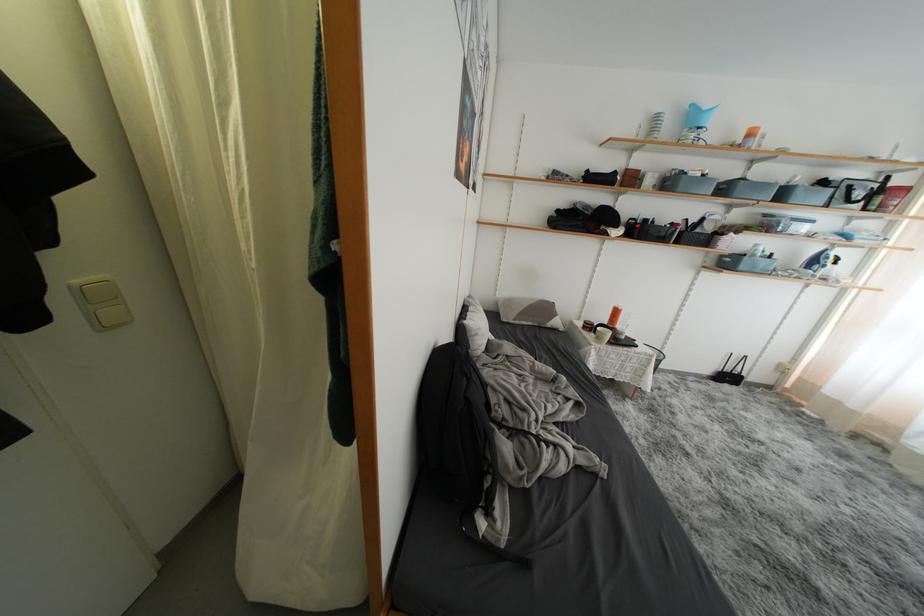
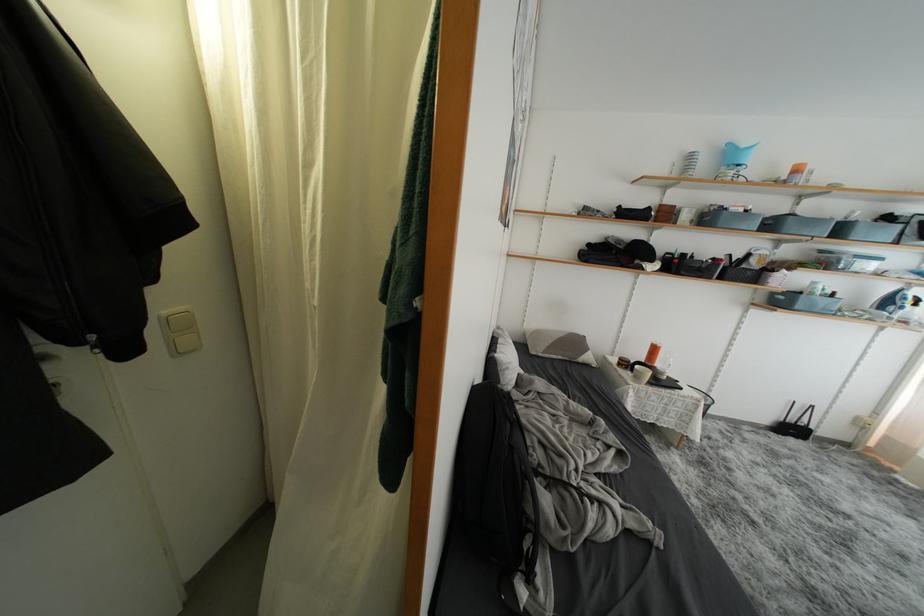
In the second image, find the point that corresponds to point (789, 199) in the first image.

(847, 235)